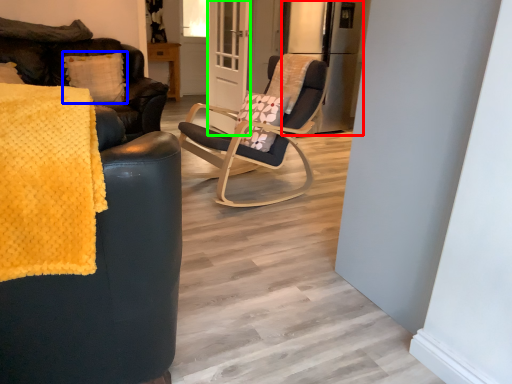
Question: Which is nearer to the appliance (highlighted by a red box)? pillow (highlighted by a blue box) or screen door (highlighted by a green box).

Choices:
 (A) pillow
 (B) screen door

Answer: (B)